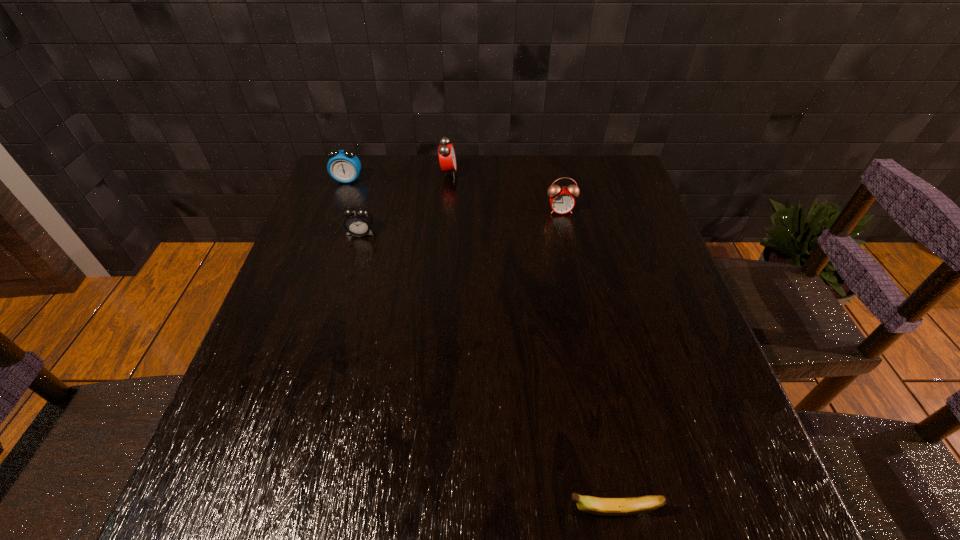
Locate an element on the screen. empty space that is in between the second nearest alarm clock and the nearest object is located at coordinates (586, 361).

Find the location of a particular element. blank region between the nearest alarm clock and the second alarm clock from right to left is located at coordinates (404, 203).

Image resolution: width=960 pixels, height=540 pixels. I want to click on vacant area between the second alarm clock from right to left and the rightmost alarm clock, so click(x=505, y=192).

The height and width of the screenshot is (540, 960). In order to click on the fourth closest object relative to the rightmost alarm clock in this screenshot , I will do `click(599, 506)`.

Select which object appears as the third closest to the third object from right to left. Please provide its 2D coordinates. Your answer should be formatted as a tuple, i.e. [(x, y)], where the tuple contains the x and y coordinates of a point satisfying the conditions above.

[(562, 201)]

Identify which alarm clock is located as the second nearest to the leftmost object. Please provide its 2D coordinates. Your answer should be formatted as a tuple, i.e. [(x, y)], where the tuple contains the x and y coordinates of a point satisfying the conditions above.

[(447, 158)]

Find the location of a particular element. The height and width of the screenshot is (540, 960). alarm clock object that ranks as the second closest to the second alarm clock from right to left is located at coordinates (358, 220).

I want to click on free space that satisfies the following two spatial constraints: 1. on the front-facing side of the third object from left to right; 2. on the face of the leftmost alarm clock, so click(x=448, y=180).